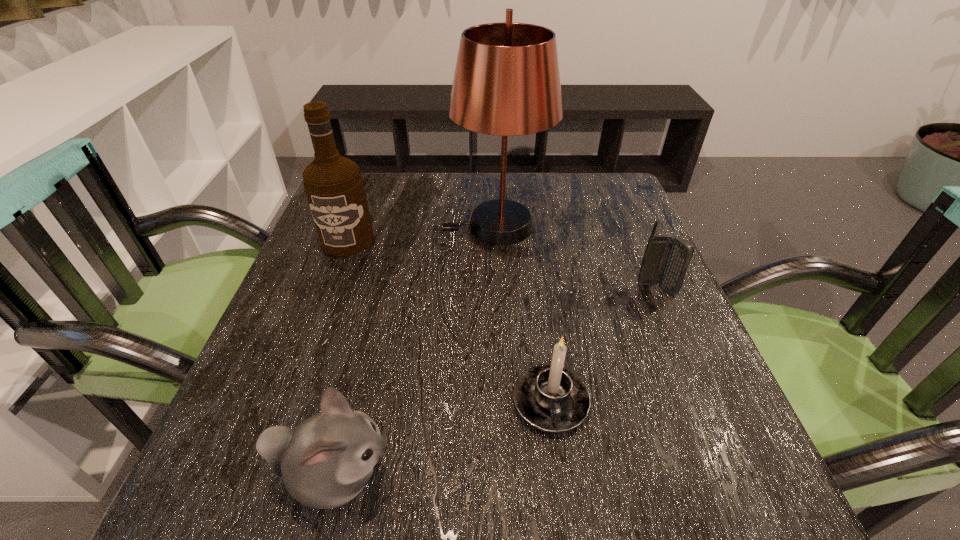
The height and width of the screenshot is (540, 960). Identify the location of blank region between the hamster and the cellular telephone. (495, 382).

I want to click on vacant area that lies between the lampshade and the third nearest object, so click(576, 258).

This screenshot has height=540, width=960. I want to click on vacant area that lies between the tallest object and the second tallest object, so pyautogui.click(x=421, y=233).

Identify the location of vacant area between the cellular telephone and the lampshade. (576, 258).

Locate an element on the screen. Image resolution: width=960 pixels, height=540 pixels. free space between the candle holder and the hamster is located at coordinates (443, 438).

Identify the location of the second closest object to the hamster. Image resolution: width=960 pixels, height=540 pixels. (334, 186).

You are a GUI agent. You are given a task and a screenshot of the screen. Output one action in this format:
    pyautogui.click(x=<x>, y=<y>)
    Task: Click on the object that is the closest to the candle holder
    This screenshot has height=540, width=960.
    Given the screenshot: What is the action you would take?
    pyautogui.click(x=325, y=462)

Image resolution: width=960 pixels, height=540 pixels. Identify the location of free space in the image that satisfies the following two spatial constraints: 1. with a handle on the side of the candle holder; 2. on the face of the hamster. (561, 475).

The image size is (960, 540). I want to click on free region that satisfies the following two spatial constraints: 1. on the front-facing side of the tallest object; 2. on the label of the second tallest object, so click(496, 240).

Find the location of `free space that satisfies the following two spatial constraints: 1. on the keyboard of the third farthest object; 2. on the face of the hamster`. free space that satisfies the following two spatial constraints: 1. on the keyboard of the third farthest object; 2. on the face of the hamster is located at coordinates (736, 475).